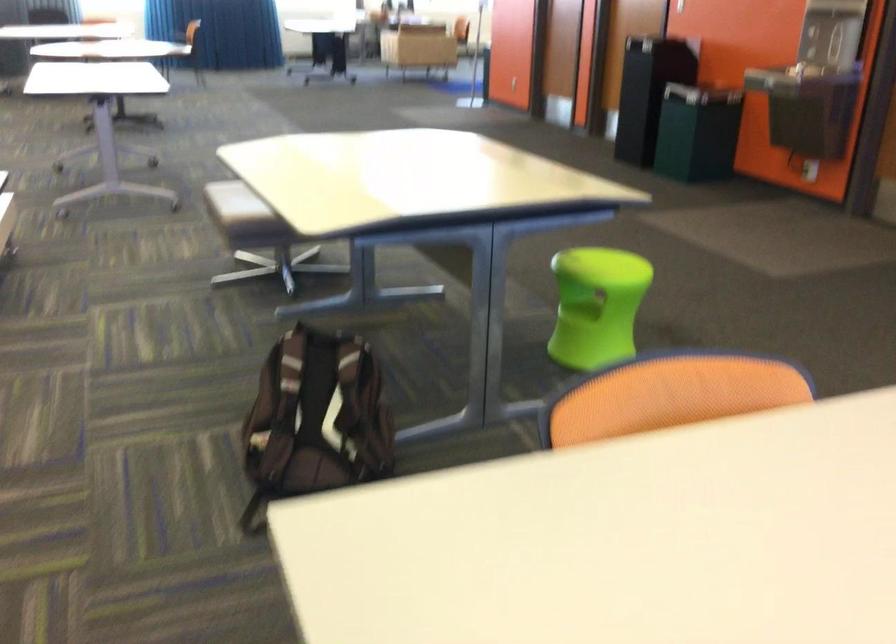
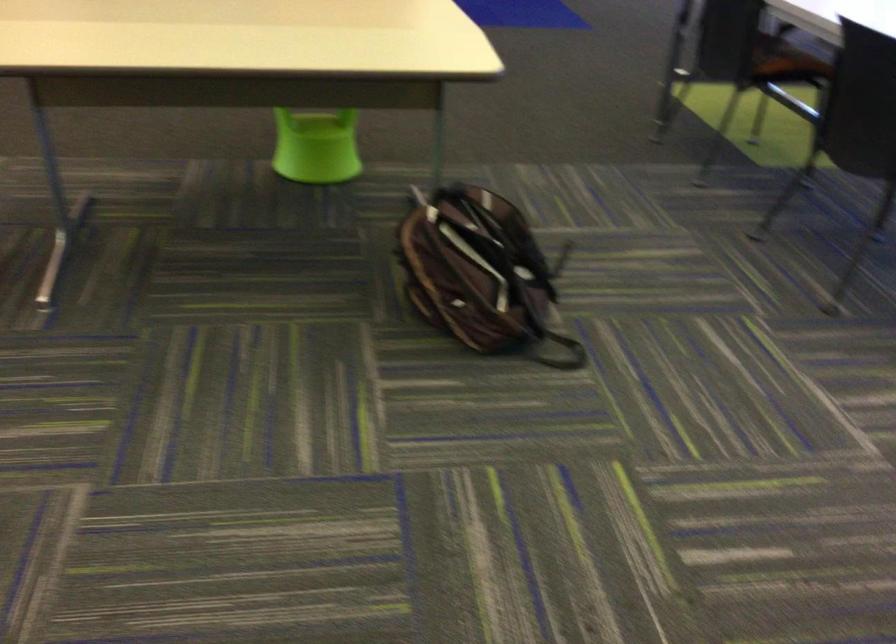
The point at (283, 408) is marked in the first image. Where is the corresponding point in the second image?

(479, 272)